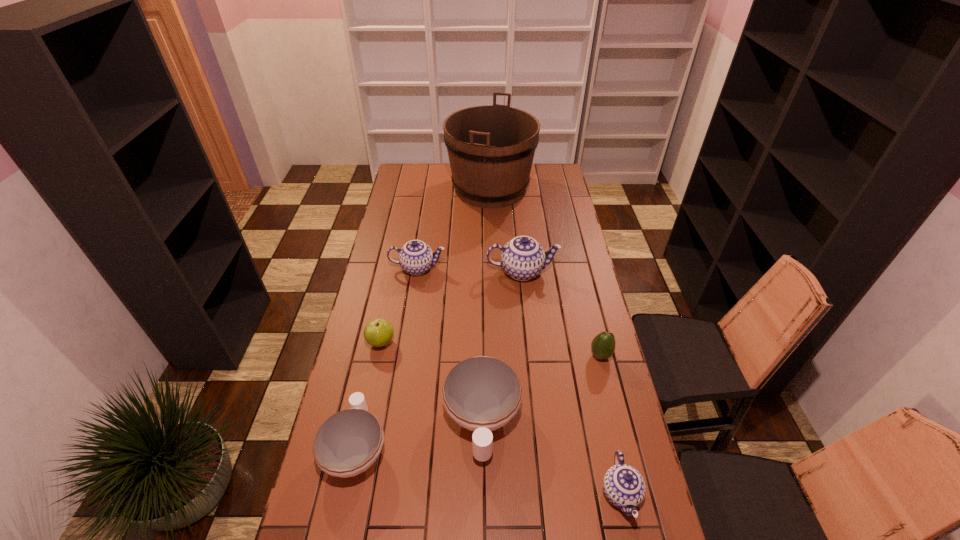
The height and width of the screenshot is (540, 960). What are the coordinates of `vacant point located between the green avocado and the tallest object` in the screenshot? It's located at (545, 272).

The image size is (960, 540). In order to click on unoccupied position between the left white chinaware and the rightmost blue chinaware in this screenshot , I will do `click(489, 470)`.

Find the location of `vacant space that is in between the left white chinaware and the tallest object`. vacant space that is in between the left white chinaware and the tallest object is located at coordinates (423, 318).

The width and height of the screenshot is (960, 540). In order to click on vacant point located between the smaller white chinaware and the leftmost blue chinaware in this screenshot , I will do `click(387, 357)`.

Identify the location of object that ranks as the closest to the tallest object. (416, 257).

Identify which object is the third nearest to the rightmost chinaware. Please provide its 2D coordinates. Your answer should be formatted as a tuple, i.e. [(x, y)], where the tuple contains the x and y coordinates of a point satisfying the conditions above.

[(348, 442)]

Locate an element on the screen. The height and width of the screenshot is (540, 960). chinaware that stands as the fourth closest to the right white chinaware is located at coordinates (416, 257).

Choose which chinaware is the third nearest neighbor to the avocado. Please provide its 2D coordinates. Your answer should be formatted as a tuple, i.e. [(x, y)], where the tuple contains the x and y coordinates of a point satisfying the conditions above.

[(624, 487)]

Identify which blue chinaware is located as the second nearest to the apple. Please provide its 2D coordinates. Your answer should be formatted as a tuple, i.e. [(x, y)], where the tuple contains the x and y coordinates of a point satisfying the conditions above.

[(522, 258)]

This screenshot has width=960, height=540. Find the location of `blue chinaware identified as the second closest to the tallest object`. blue chinaware identified as the second closest to the tallest object is located at coordinates (522, 258).